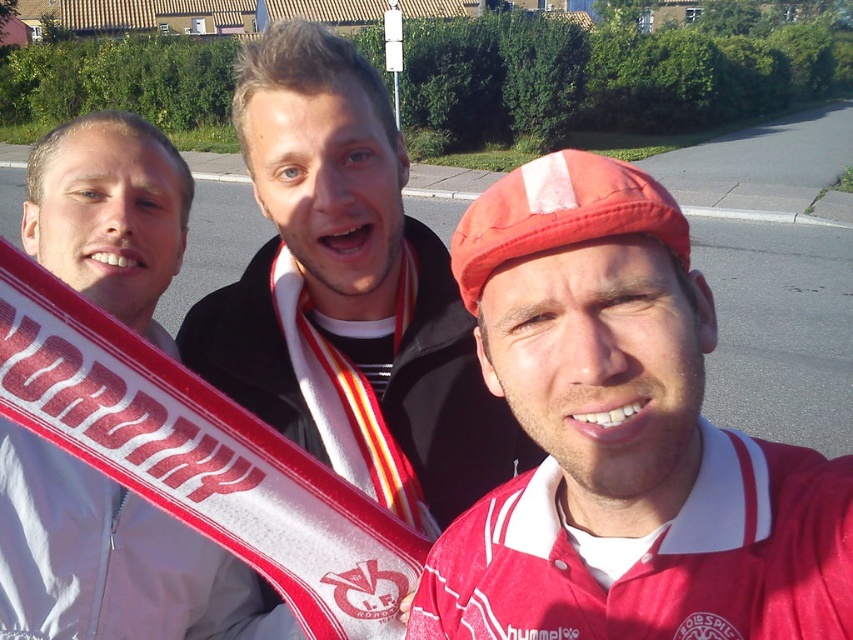
In the scene shown: You are trying to decide which item to take with you for a quick walk. Based on the scene, which object is bigger and more suitable for warmth, the matte black jacket at center or the white fabric scarf at left?

The matte black jacket at center is larger in size than the white fabric scarf at left, so it would be more suitable for warmth.

You are a photographer setting up a tripod to capture a group photo. The matte red cap at center and the white fabric scarf at left are in your frame. Based on their heights, which object should you adjust your camera angle to focus on first to ensure both are in focus?

The matte red cap at center is taller than the white fabric scarf at left, so you should focus on the matte red cap at center first to ensure both are in focus.